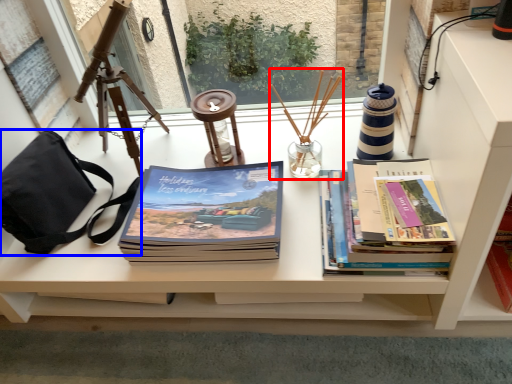
Question: Which object appears closest to the camera in this image, candle holder (highlighted by a red box) or handbag (highlighted by a blue box)?

Choices:
 (A) candle holder
 (B) handbag

Answer: (B)